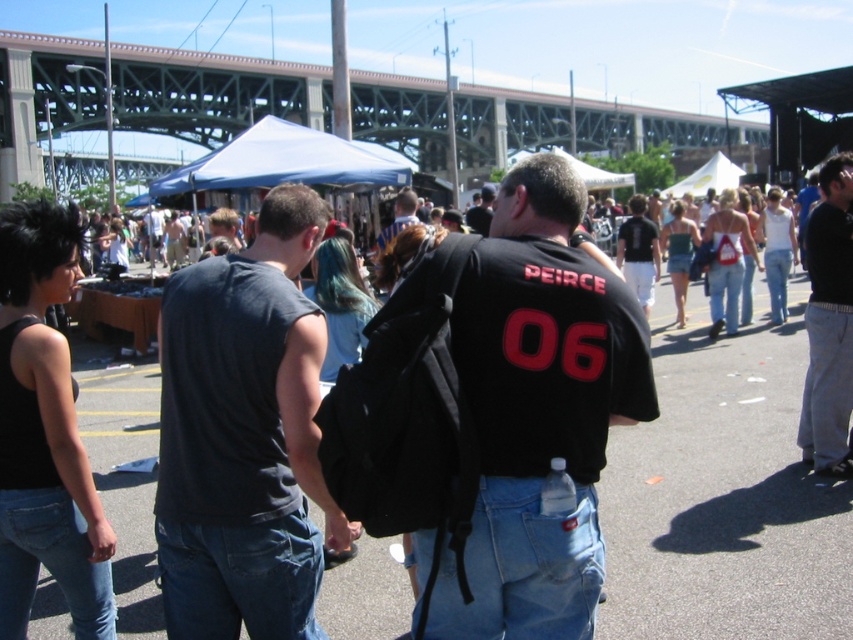
You are standing at the center of the parking lot and want to locate the blue fabric canopy at upper center. According to the coordinates provided, in which direction should you look to find it?

The blue fabric canopy at upper center is located at point (287, 161). Since the coordinates are in the upper center area, you should look towards the upper part of the scene to find it.

You are standing at the blue fabric canopy at upper center and want to hand out flyers to people passing by. There is a person wearing a black matte jersey at center. Can you reach them with a 15 meter long megaphone to ask them to stop for the flyers?

The black matte jersey at center is 19.31 meters away from the blue fabric canopy at upper center. Since the megaphone is only 15 meters long, you cannot reach them to ask them to stop for the flyers.